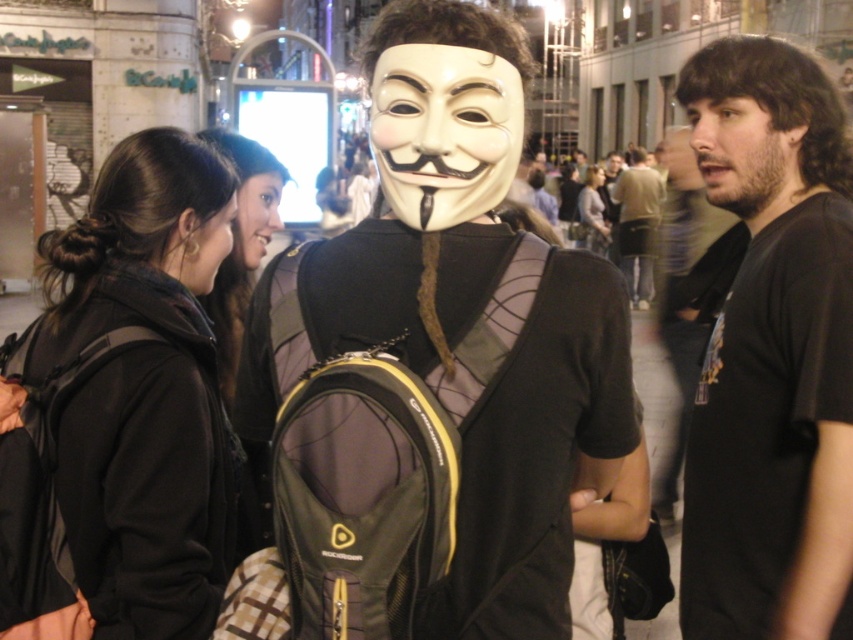
Who is taller, dark brown hair at center or smooth skin face at center?

dark brown hair at center

Does dark brown hair at center have a lesser height compared to smooth skin face at center?

In fact, dark brown hair at center may be taller than smooth skin face at center.

You are a GUI agent. You are given a task and a screenshot of the screen. Output one action in this format:
    pyautogui.click(x=<x>, y=<y>)
    Task: Click on the dark brown hair at center
    Image resolution: width=853 pixels, height=640 pixels.
    Given the screenshot: What is the action you would take?
    pyautogui.click(x=242, y=243)

Is white matte mask at center to the left of dark brown leather jacket at center from the viewer's perspective?

Correct, you'll find white matte mask at center to the left of dark brown leather jacket at center.

In the scene shown: Does white matte mask at center appear on the right side of dark brown leather jacket at center?

No, white matte mask at center is not to the right of dark brown leather jacket at center.

At what (x,y) coordinates should I click in order to perform the action: click on white matte mask at center. Please return your answer as a coordinate pair (x, y). The image size is (853, 640). Looking at the image, I should click on (444, 131).

Is matte black backpack at center thinner than dark brown leather jacket at center?

Yes.

Is point (305, 625) positioned behind point (648, 280)?

No, it is in front of (648, 280).

Identify the location of matte black backpack at center. The image size is (853, 640). (436, 365).